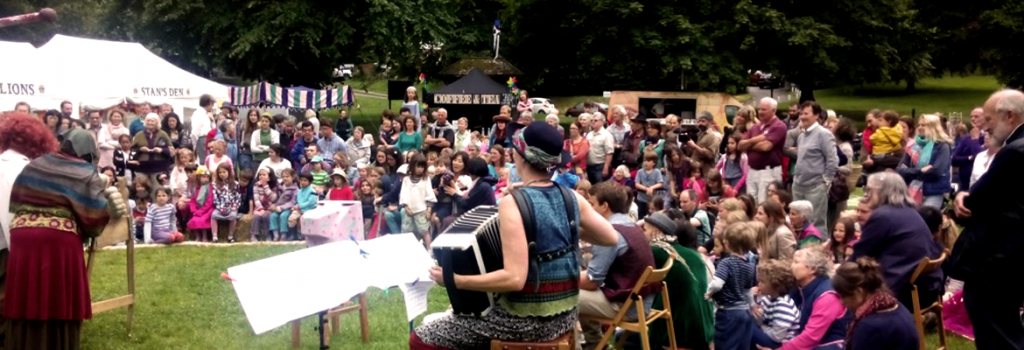
Where is `chair`? chair is located at coordinates (654, 278).